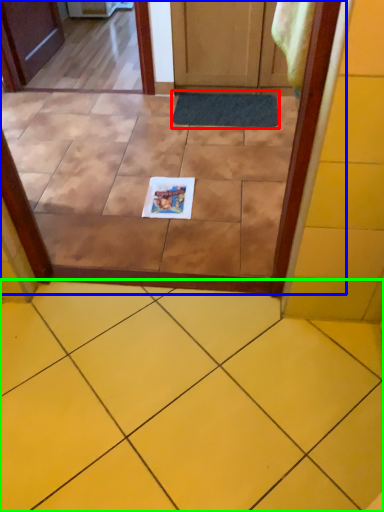
Question: Which object is the closest to the doormat (highlighted by a red box)? Choose among these: glass door (highlighted by a blue box) or ceramic tile (highlighted by a green box).

Choices:
 (A) glass door
 (B) ceramic tile

Answer: (A)